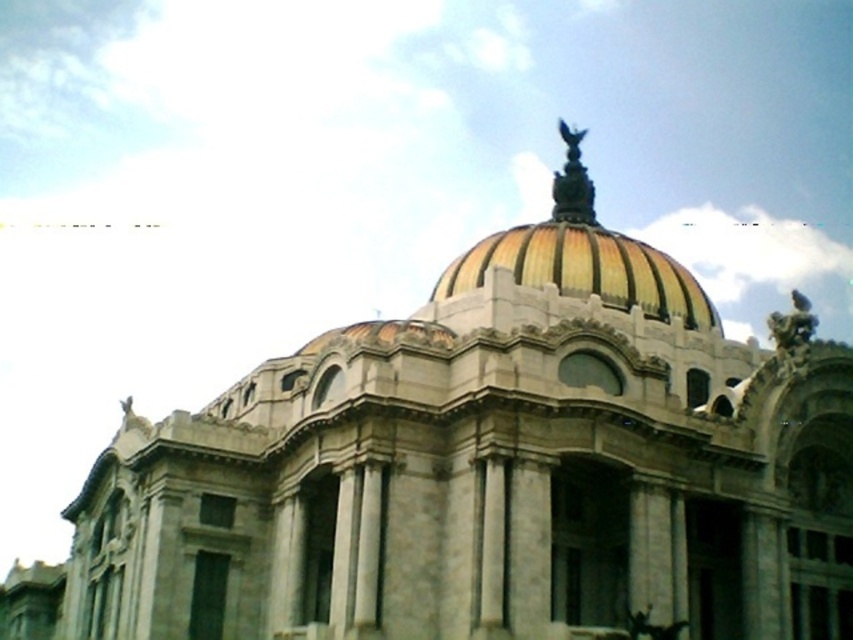
You are standing in front of the grand building and want to locate the point at coordinates (572, 182). Based on the scene description, where would this point be located?

The point at coordinates (572, 182) is located on the gold metallic statue at top of the building.

You are an architect analyzing the proportions of the building. Given that the gold mosaic dome at center and the bronze statue at upper right are key elements, which of these two objects has a smaller width?

The gold mosaic dome at center has a lesser width compared to the bronze statue at upper right, so the gold mosaic dome at center is smaller in width.